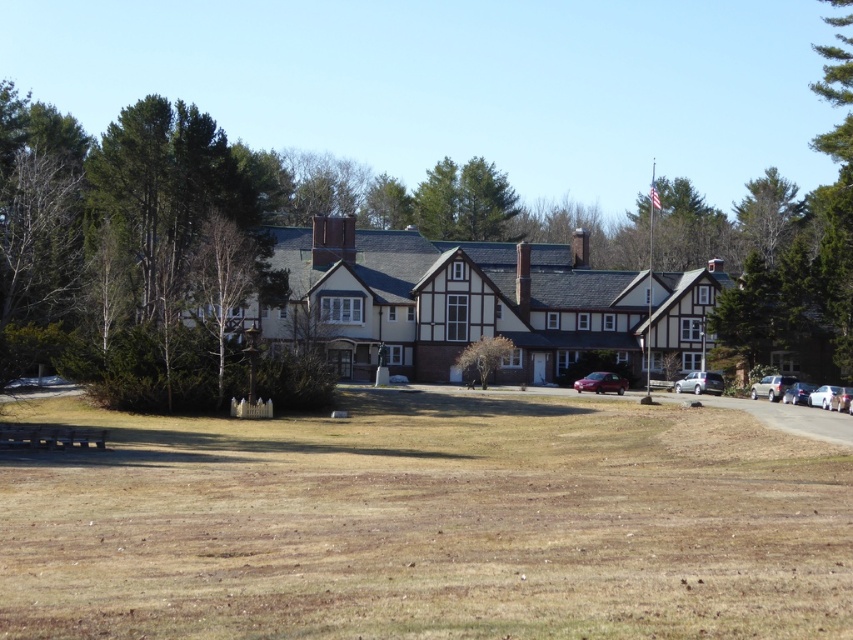
Is point (321, 541) in front of point (483, 385)?

Yes, it is in front of point (483, 385).

Between point (479, 541) and point (489, 369), which one is positioned behind?

The point (489, 369) is more distant.

Does point (491, 608) come closer to viewer compared to point (474, 368)?

Yes, point (491, 608) is closer to viewer.

At what (x,y) coordinates should I click in order to perform the action: click on brown grass at lower center. Please return your answer as a coordinate pair (x, y). This screenshot has height=640, width=853. Looking at the image, I should click on (428, 524).

Between satin silver suv at right and metallic red car at center, which one is positioned lower?

Positioned lower is satin silver suv at right.

Does point (711, 388) lie in front of point (595, 384)?

No, (711, 388) is behind (595, 384).

Looking at this image, who is more distant from viewer, [717,384] or [584,388]?

The point [717,384] is more distant.

Where is `satin silver suv at right`? This screenshot has width=853, height=640. satin silver suv at right is located at coordinates (700, 381).

Can you confirm if white glossy car at right is smaller than satin silver sedan at right?

Indeed, white glossy car at right has a smaller size compared to satin silver sedan at right.

Looking at this image, is the position of white glossy car at right more distant than that of satin silver sedan at right?

No, it is in front of satin silver sedan at right.

Which is behind, point (822, 390) or point (788, 378)?

The point (788, 378) is behind.

Where is `white glossy car at right`? white glossy car at right is located at coordinates (830, 397).